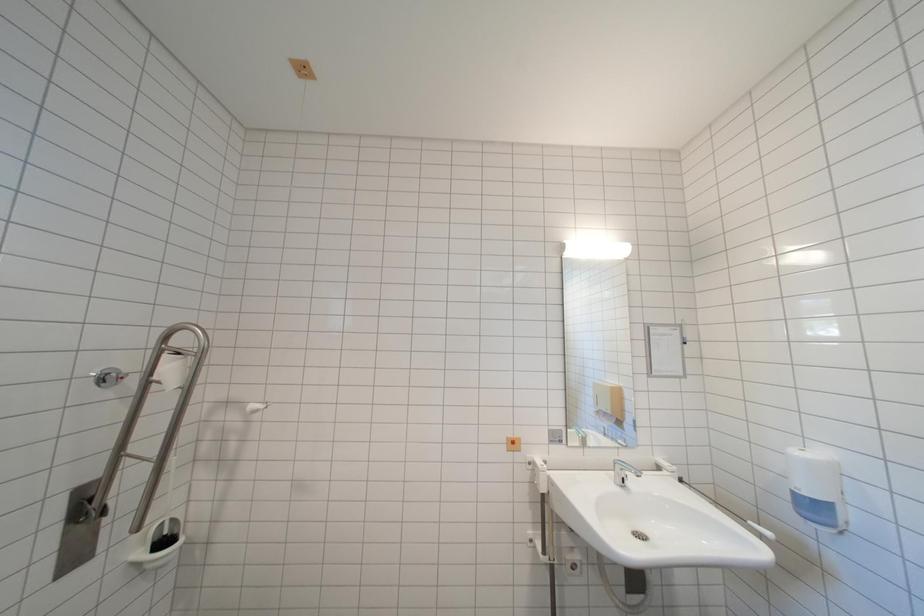
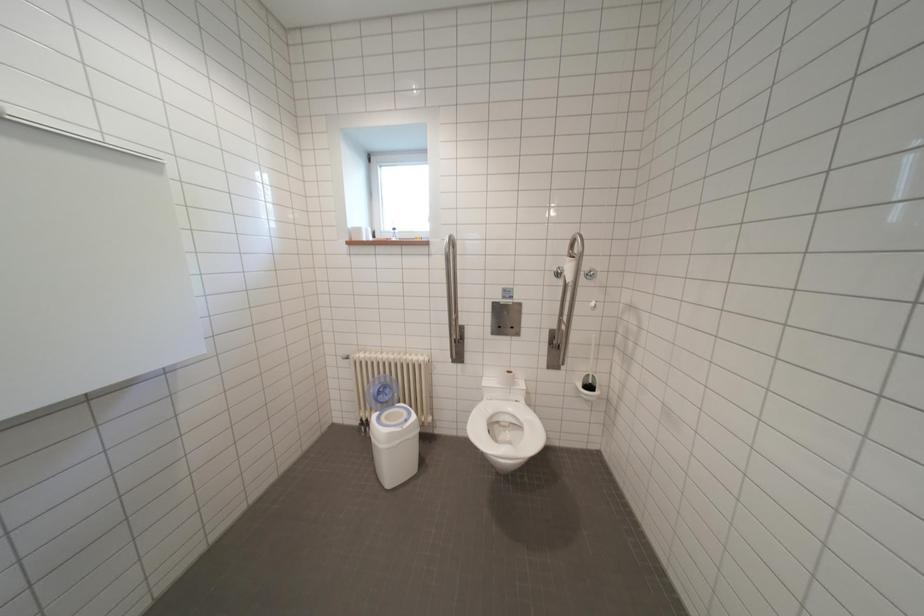
Question: The first image is from the beginning of the video and the second image is from the end. How did the camera likely rotate when shooting the video?

Choices:
 (A) Left
 (B) Right
 (C) Up
 (D) Down

Answer: (A)